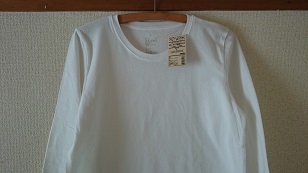
Locate an element on the screen. wood of hanger is located at coordinates (131, 17), (166, 16).